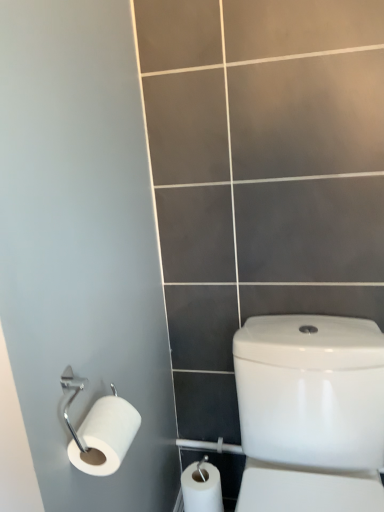
Question: From their relative heights in the image, would you say white glossy water tank at right is taller or shorter than white matte toilet paper at left?

Choices:
 (A) short
 (B) tall

Answer: (B)

Question: Considering the positions of white glossy water tank at right and white matte toilet paper at left in the image, is white glossy water tank at right wider or thinner than white matte toilet paper at left?

Choices:
 (A) thin
 (B) wide

Answer: (B)

Question: Does point (306, 394) appear closer or farther from the camera than point (119, 441)?

Choices:
 (A) closer
 (B) farther

Answer: (B)

Question: Is white matte toilet paper at left in front of or behind white glossy water tank at right in the image?

Choices:
 (A) front
 (B) behind

Answer: (B)

Question: Is white matte toilet paper at left to the left or to the right of white glossy water tank at right in the image?

Choices:
 (A) left
 (B) right

Answer: (A)

Question: From the image's perspective, is white matte toilet paper at left above or below white glossy water tank at right?

Choices:
 (A) above
 (B) below

Answer: (A)

Question: Considering the positions of white matte toilet paper at left and white glossy water tank at right in the image, is white matte toilet paper at left taller or shorter than white glossy water tank at right?

Choices:
 (A) tall
 (B) short

Answer: (B)